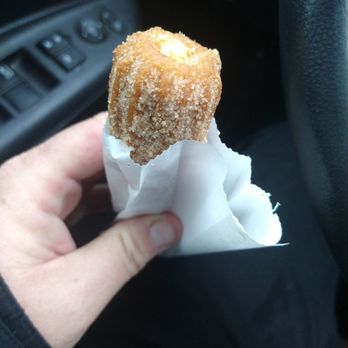
Where is `unlock door button`? This screenshot has height=348, width=348. unlock door button is located at coordinates (67, 58).